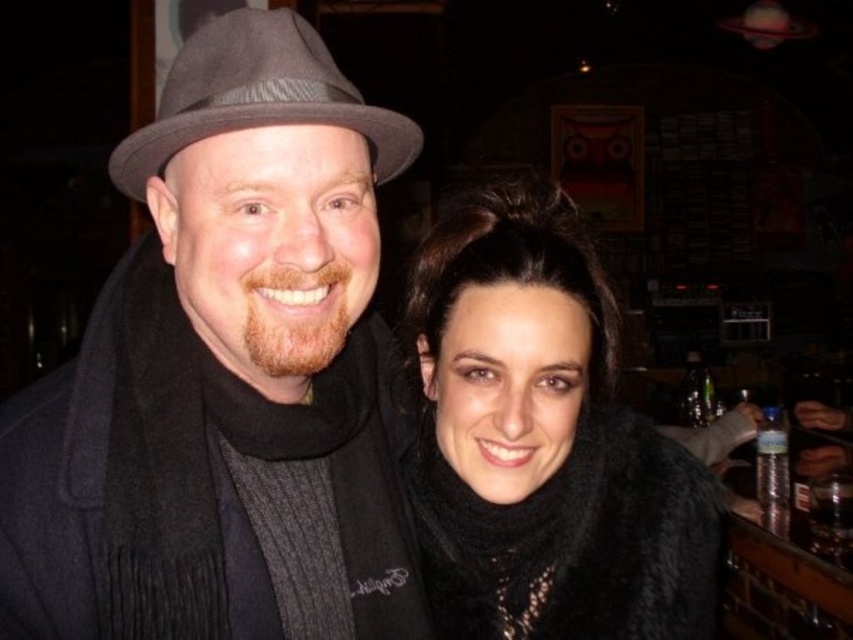
Which of these two, black fuzzy scarf at right or gray felt fedora at upper left, stands shorter?

gray felt fedora at upper left is shorter.

Who is more distant from viewer, [630,552] or [184,42]?

The point [630,552] is behind.

Between point (693, 548) and point (224, 80), which one is positioned behind?

The point (693, 548) is behind.

This screenshot has height=640, width=853. In order to click on black fuzzy scarf at right in this screenshot , I will do `click(544, 444)`.

Can you confirm if matte black coat at left is taller than black fuzzy scarf at right?

Yes.

Can you confirm if matte black coat at left is positioned to the right of black fuzzy scarf at right?

In fact, matte black coat at left is to the left of black fuzzy scarf at right.

What are the coordinates of `matte black coat at left` in the screenshot? It's located at (225, 376).

The image size is (853, 640). Find the location of `matte black coat at left`. matte black coat at left is located at coordinates (225, 376).

Does matte black coat at left have a lesser height compared to gray felt fedora at upper left?

Incorrect, matte black coat at left's height does not fall short of gray felt fedora at upper left's.

Between matte black coat at left and gray felt fedora at upper left, which one is positioned higher?

gray felt fedora at upper left is higher up.

This screenshot has height=640, width=853. What do you see at coordinates (225, 376) in the screenshot?
I see `matte black coat at left` at bounding box center [225, 376].

Find the location of `matte black coat at left`. matte black coat at left is located at coordinates (225, 376).